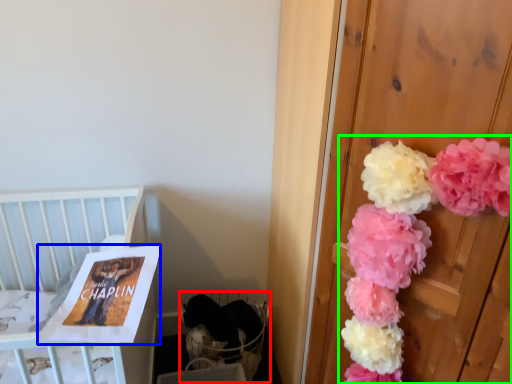
Question: Which object is positioned closest to baby carriage (highlighted by a red box)? Select from magazine (highlighted by a blue box) and floral arrangement (highlighted by a green box).

Choices:
 (A) magazine
 (B) floral arrangement

Answer: (A)